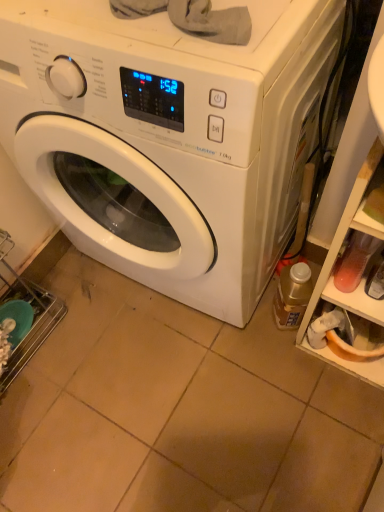
Where is `vacant space positioned to the left of translucent plastic bottle at lower right`? The width and height of the screenshot is (384, 512). vacant space positioned to the left of translucent plastic bottle at lower right is located at coordinates (238, 336).